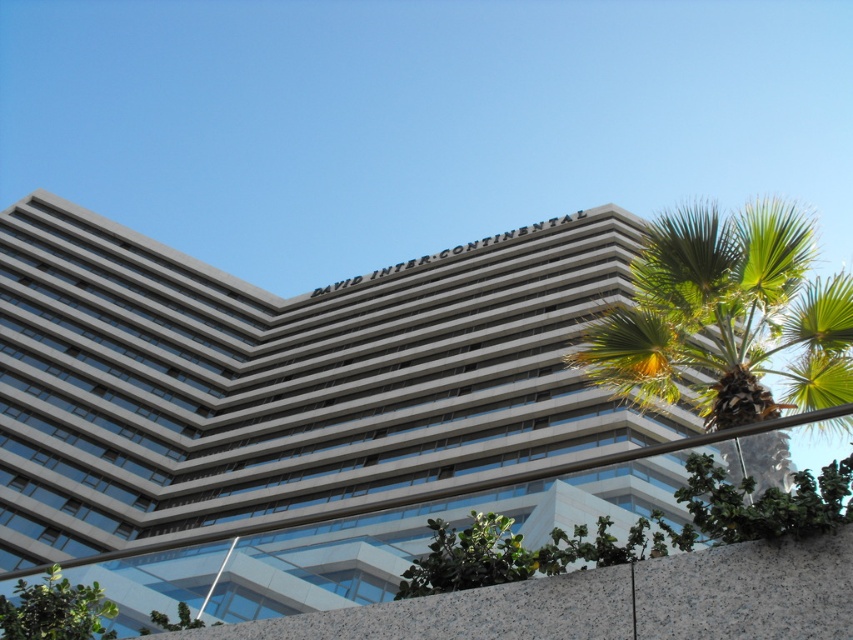
Question: Which point is closer to the camera?

Choices:
 (A) (718, 248)
 (B) (68, 605)
 (C) (502, 566)

Answer: (C)

Question: Can you confirm if green leafy palm tree at right is positioned to the right of green leafy tree at lower left?

Choices:
 (A) no
 (B) yes

Answer: (B)

Question: Which of the following is the farthest from the observer?

Choices:
 (A) (433, 525)
 (B) (78, 584)

Answer: (B)

Question: Does green leafy palm tree at right appear under green leafy tree at lower left?

Choices:
 (A) yes
 (B) no

Answer: (B)

Question: Among these points, which one is nearest to the camera?

Choices:
 (A) (668, 358)
 (B) (65, 611)
 (C) (463, 532)

Answer: (C)

Question: Is green leafy palm tree at right positioned before green leafy plant at lower center?

Choices:
 (A) yes
 (B) no

Answer: (A)